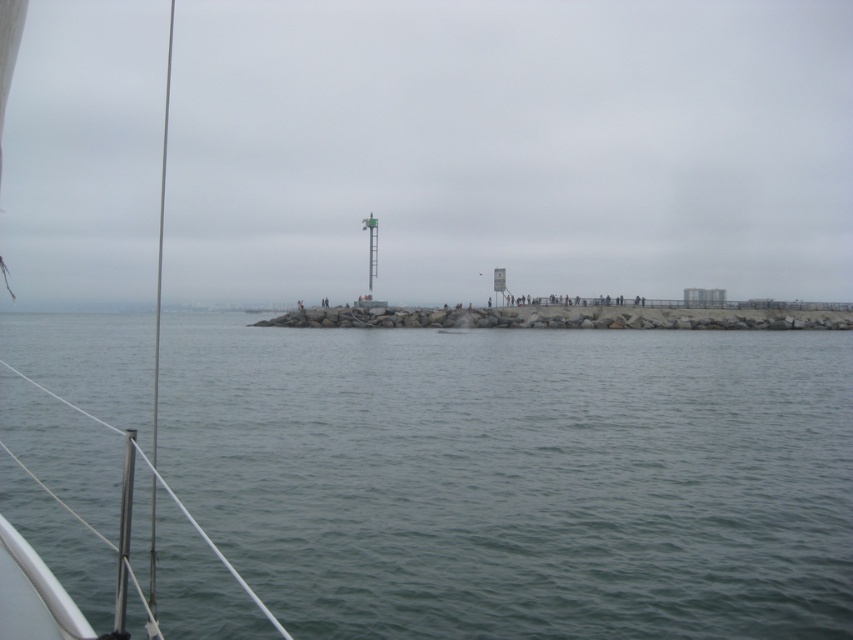
Who is taller, gray matte water at center or white matte boat at center?

With more height is white matte boat at center.

Does point (635, 449) come closer to viewer compared to point (42, 628)?

No, (635, 449) is further to viewer.

At what (x,y) coordinates should I click in order to perform the action: click on gray matte water at center. Please return your answer as a coordinate pair (x, y). The height and width of the screenshot is (640, 853). Looking at the image, I should click on (519, 477).

Where is `gray matte water at center`? gray matte water at center is located at coordinates (519, 477).

Describe the element at coordinates (519, 477) in the screenshot. I see `gray matte water at center` at that location.

Who is positioned more to the right, gray matte water at center or gray concrete pier at center?

gray matte water at center

The image size is (853, 640). What do you see at coordinates (519, 477) in the screenshot? I see `gray matte water at center` at bounding box center [519, 477].

Locate an element on the screen. gray matte water at center is located at coordinates (519, 477).

Who is higher up, gray concrete pier at center or white matte boat at center?

Positioned higher is gray concrete pier at center.

Is point (73, 253) closer to viewer compared to point (19, 36)?

That is False.

The width and height of the screenshot is (853, 640). Find the location of `gray concrete pier at center`. gray concrete pier at center is located at coordinates (509, 148).